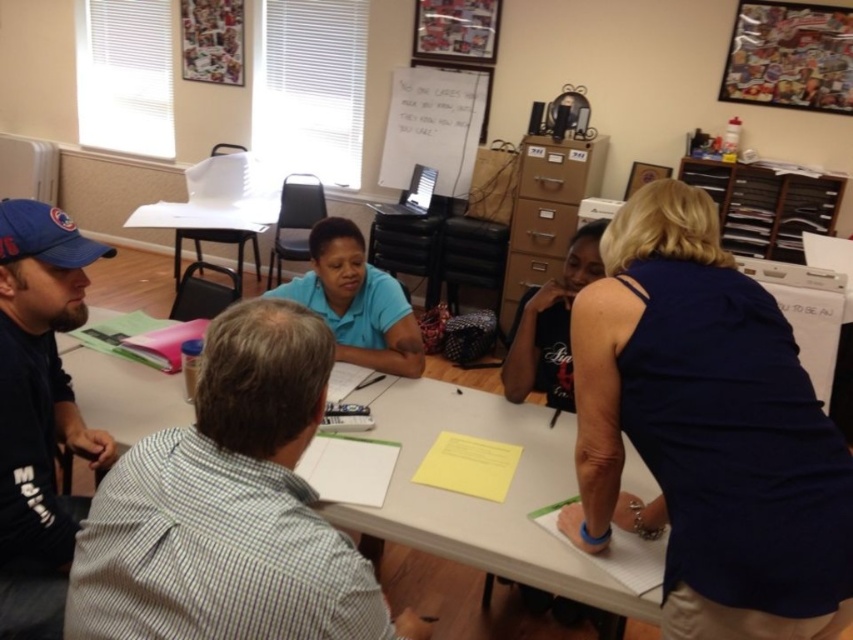
You are a participant in the meeting and need to pass a note to the person in the blue shirt at center without touching the white paper at center. How can you do this?

Since the white paper at center is in front of the blue shirt at center, you can pass the note around the sides of the white paper at center to reach the blue shirt at center without touching it.

Based on the coordinates provided, which object corresponds to the point at (706, 432)?

The point at (706, 432) corresponds to the dark blue sleeveless top at upper right.